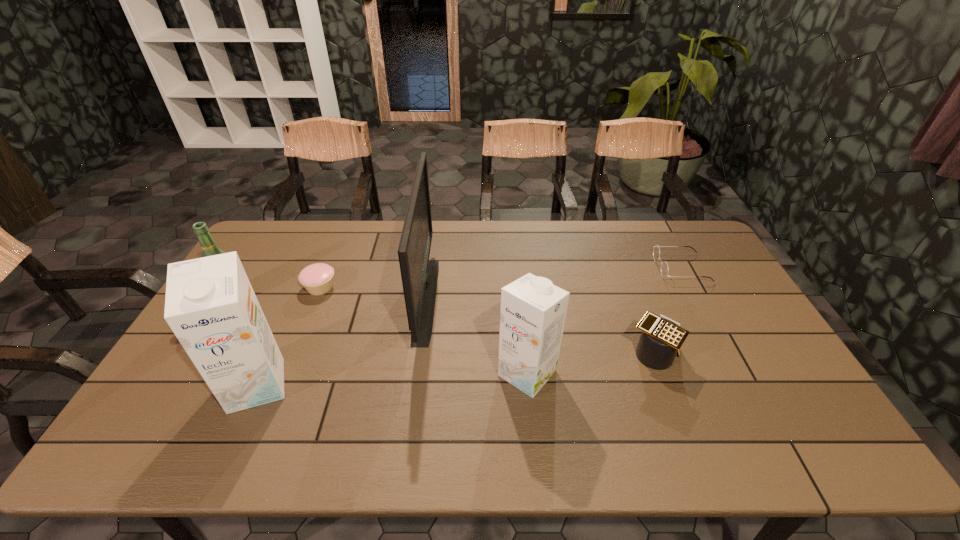
Locate which object ranks in proximity to the monitor. Please provide its 2D coordinates. Your answer should be formatted as a tuple, i.e. [(x, y)], where the tuple contains the x and y coordinates of a point satisfying the conditions above.

[(532, 315)]

Locate which object ranks fifth in proximity to the leftmost object. Please provide its 2D coordinates. Your answer should be formatted as a tuple, i.e. [(x, y)], where the tuple contains the x and y coordinates of a point satisfying the conditions above.

[(661, 338)]

Identify the location of free spot that satisfies the following two spatial constraints: 1. on the front-facing side of the right carton; 2. on the left side of the monitor. (417, 373).

The width and height of the screenshot is (960, 540). Identify the location of free spot that satisfies the following two spatial constraints: 1. on the front-facing side of the shortest object; 2. on the front side of the taller carton. (743, 386).

The height and width of the screenshot is (540, 960). What are the coordinates of `free region that satisfies the following two spatial constraints: 1. on the front-facing side of the second object from right to left; 2. on the left side of the monitor` in the screenshot? It's located at (419, 354).

Image resolution: width=960 pixels, height=540 pixels. What are the coordinates of `vacant region that satisfies the following two spatial constraints: 1. on the front-facing side of the calculator; 2. on the right side of the monitor` in the screenshot? It's located at (419, 354).